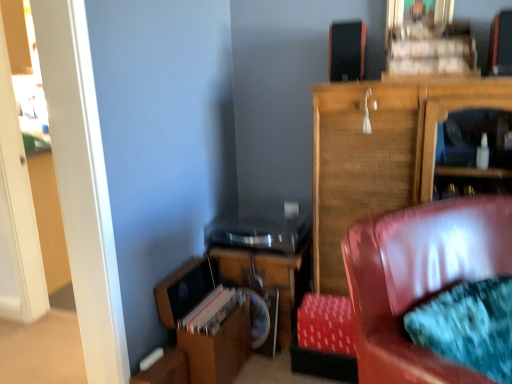
Question: From the image's perspective, is wooden table at lower center located above or below black matte speaker at upper center?

Choices:
 (A) above
 (B) below

Answer: (B)

Question: Considering the relative positions of wooden table at lower center and black matte speaker at upper center in the image provided, is wooden table at lower center to the left or to the right of black matte speaker at upper center?

Choices:
 (A) left
 (B) right

Answer: (A)

Question: Estimate the real-world distances between objects in this image. Which object is closer to the leather couch at lower right?

Choices:
 (A) wooden table at lower center
 (B) black matte speaker at upper center
 (C) red fabric footrest at lower right
 (D) wooden cabinet at upper right

Answer: (C)

Question: Estimate the real-world distances between objects in this image. Which object is closer to the wooden table at lower center?

Choices:
 (A) leather couch at lower right
 (B) wooden cabinet at upper right
 (C) red fabric footrest at lower right
 (D) black matte speaker at upper center

Answer: (C)